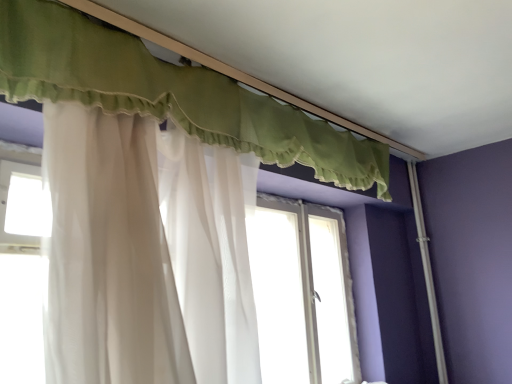
What do you see at coordinates (143, 256) in the screenshot?
I see `sheer white curtain at center` at bounding box center [143, 256].

Where is `sheer white curtain at center`? The width and height of the screenshot is (512, 384). sheer white curtain at center is located at coordinates (143, 256).

Locate an element on the screen. The height and width of the screenshot is (384, 512). sheer white curtain at center is located at coordinates (143, 256).